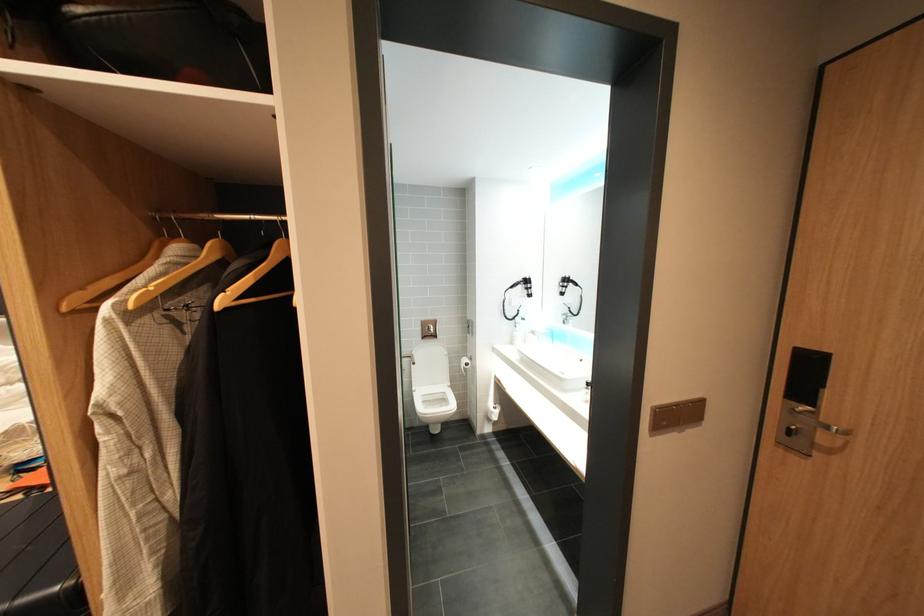
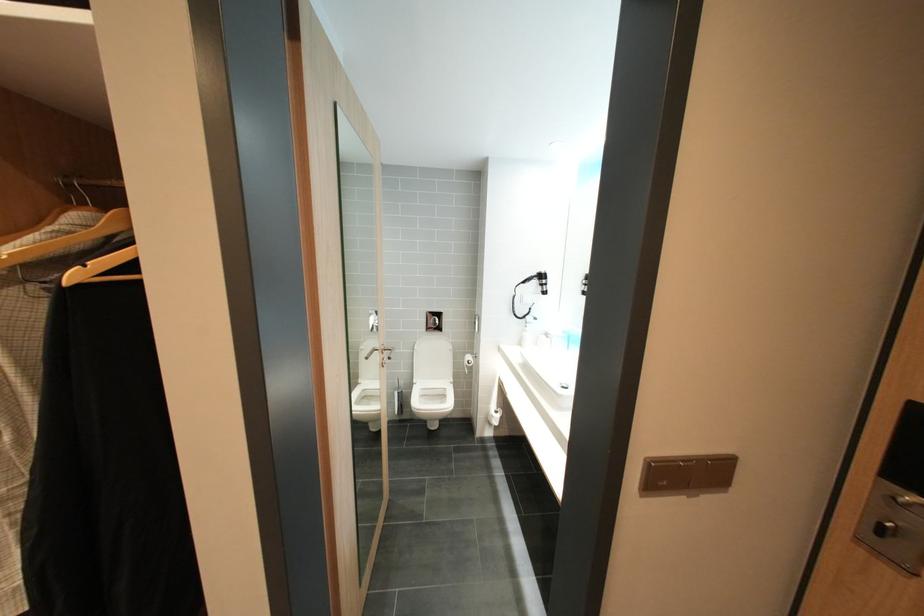
In a continuous first-person perspective shot, in which direction is the camera moving?

The cameraman walked toward right, forward.